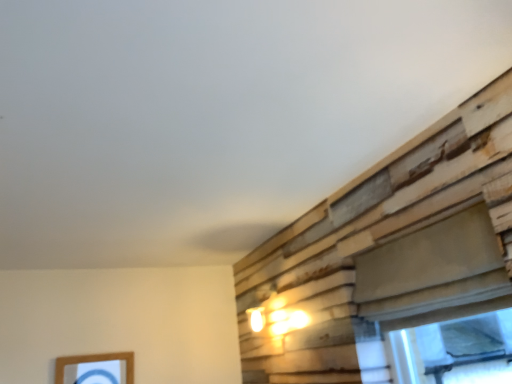
Question: Is smooth beige window at right surrounded by wooden picture frame at lower left?

Choices:
 (A) no
 (B) yes

Answer: (A)

Question: From the image's perspective, is wooden picture frame at lower left below smooth beige window at right?

Choices:
 (A) yes
 (B) no

Answer: (A)

Question: Is wooden picture frame at lower left to the right of smooth beige window at right from the viewer's perspective?

Choices:
 (A) no
 (B) yes

Answer: (A)

Question: Does wooden picture frame at lower left have a greater height compared to smooth beige window at right?

Choices:
 (A) yes
 (B) no

Answer: (B)

Question: Are wooden picture frame at lower left and smooth beige window at right beside each other?

Choices:
 (A) no
 (B) yes

Answer: (A)

Question: Can you confirm if wooden picture frame at lower left is positioned to the left of smooth beige window at right?

Choices:
 (A) yes
 (B) no

Answer: (A)

Question: Is smooth beige window at right oriented away from wooden picture frame at lower left?

Choices:
 (A) yes
 (B) no

Answer: (B)

Question: From the image's perspective, is smooth beige window at right on wooden picture frame at lower left?

Choices:
 (A) yes
 (B) no

Answer: (A)

Question: Considering the relative sizes of smooth beige window at right and wooden picture frame at lower left in the image provided, is smooth beige window at right taller than wooden picture frame at lower left?

Choices:
 (A) no
 (B) yes

Answer: (B)

Question: Is smooth beige window at right thinner than wooden picture frame at lower left?

Choices:
 (A) no
 (B) yes

Answer: (A)

Question: Is smooth beige window at right positioned far away from wooden picture frame at lower left?

Choices:
 (A) no
 (B) yes

Answer: (B)

Question: Considering the relative sizes of smooth beige window at right and wooden picture frame at lower left in the image provided, is smooth beige window at right bigger than wooden picture frame at lower left?

Choices:
 (A) yes
 (B) no

Answer: (A)

Question: Choose the correct answer: Is smooth beige window at right inside wooden picture frame at lower left or outside it?

Choices:
 (A) inside
 (B) outside

Answer: (B)